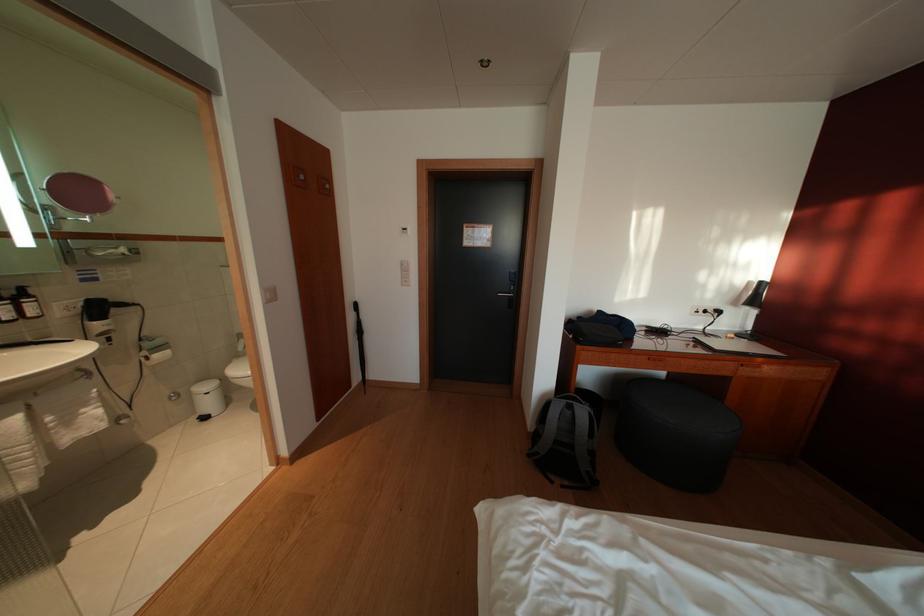
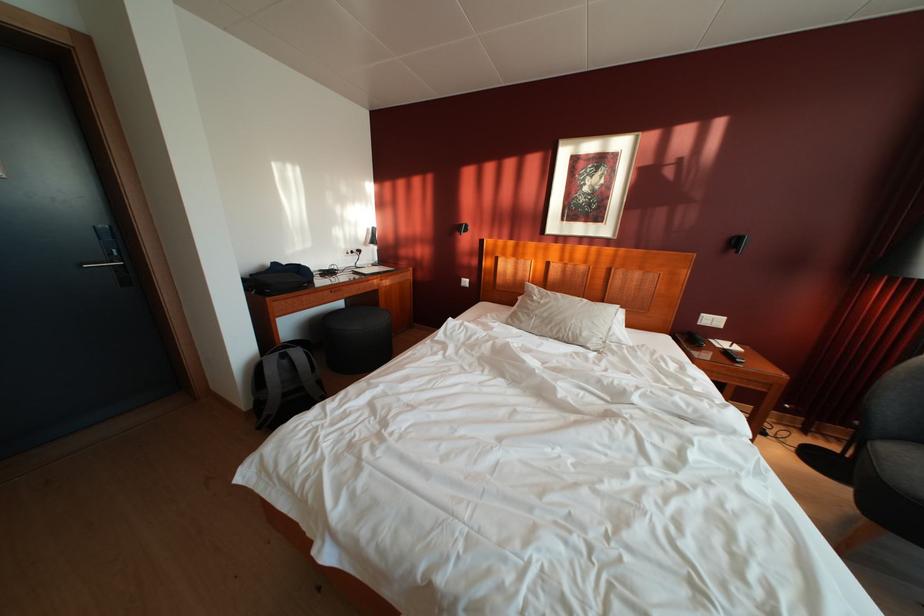
Where in the second image is the point corresponding to point 609,318 from the first image?

(284, 270)